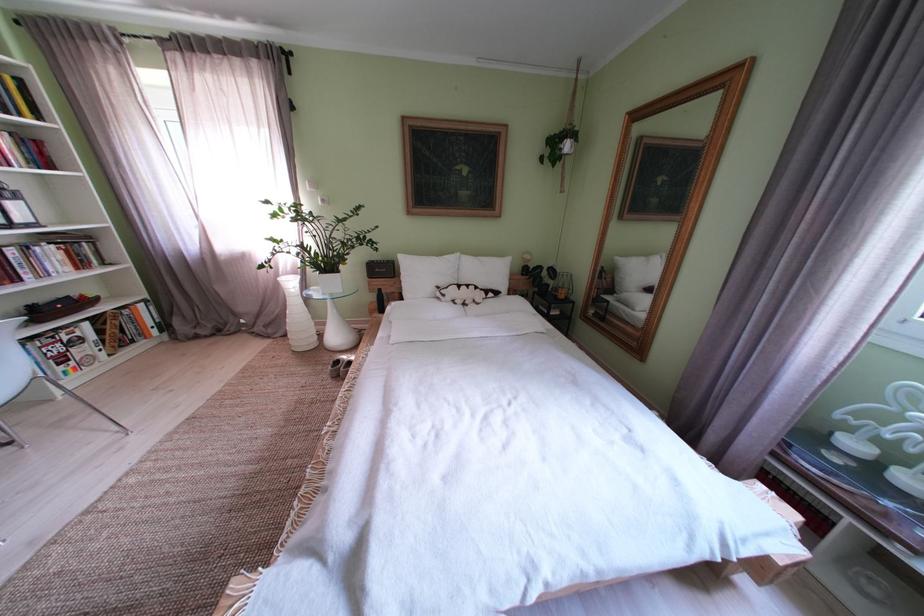
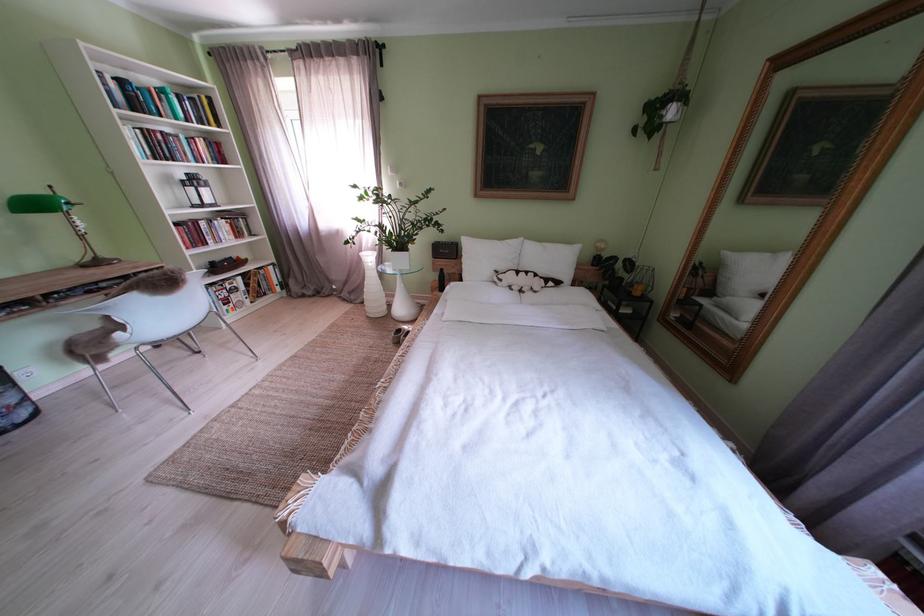
In the second image, find the point that corresponds to point (573, 302) in the first image.

(648, 299)